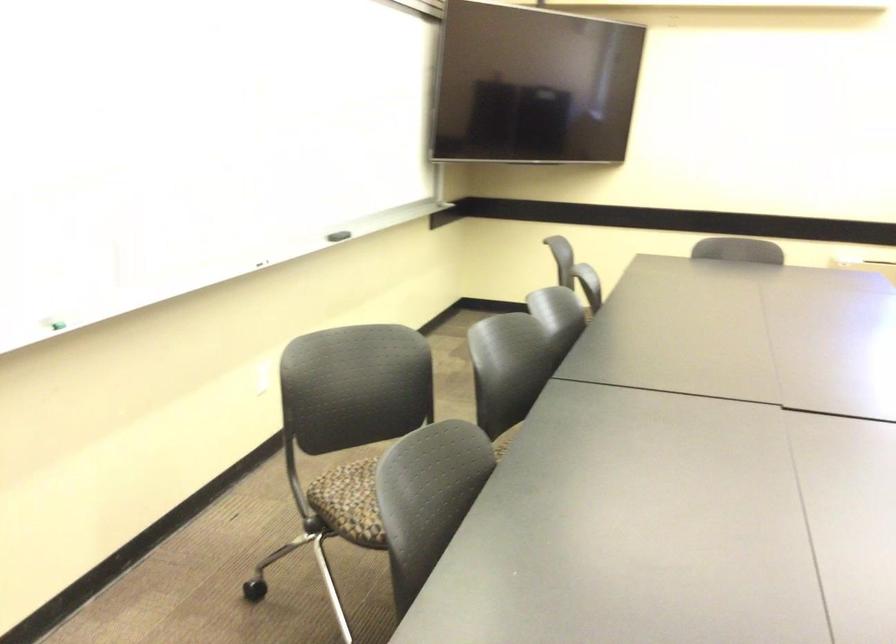
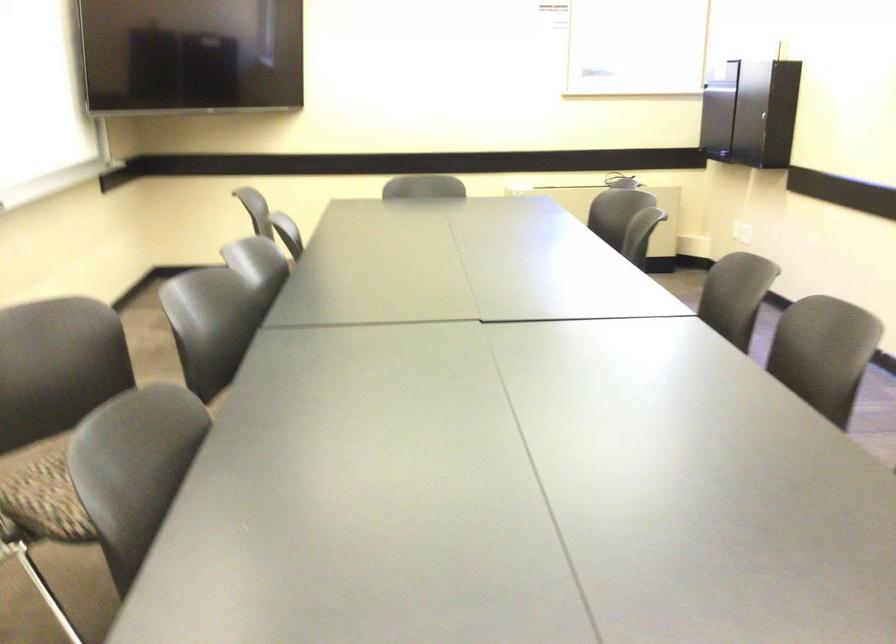
Question: The camera is either moving clockwise (left) or counter-clockwise (right) around the object. The first image is from the beginning of the video and the second image is from the end. Is the camera moving left or right when shooting the video?

Choices:
 (A) Left
 (B) Right

Answer: (A)